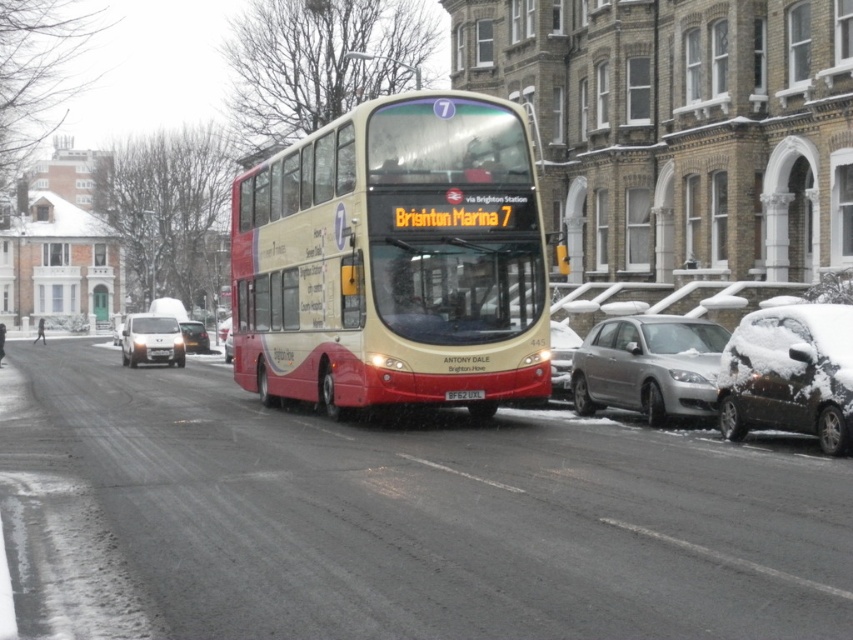
You are a delivery driver needing to park your 2.5 meter wide truck. You see the silver metallic sedan at lower right and the satin silver van at left in the parking area. Which vehicle can your truck fit into the parking space designed for?

The satin silver van at left has a wider width than the silver metallic sedan at lower right. Since your truck is 2.5 meters wide, it can fit into the parking space designed for the satin silver van at left if the space is appropriately sized for its width.